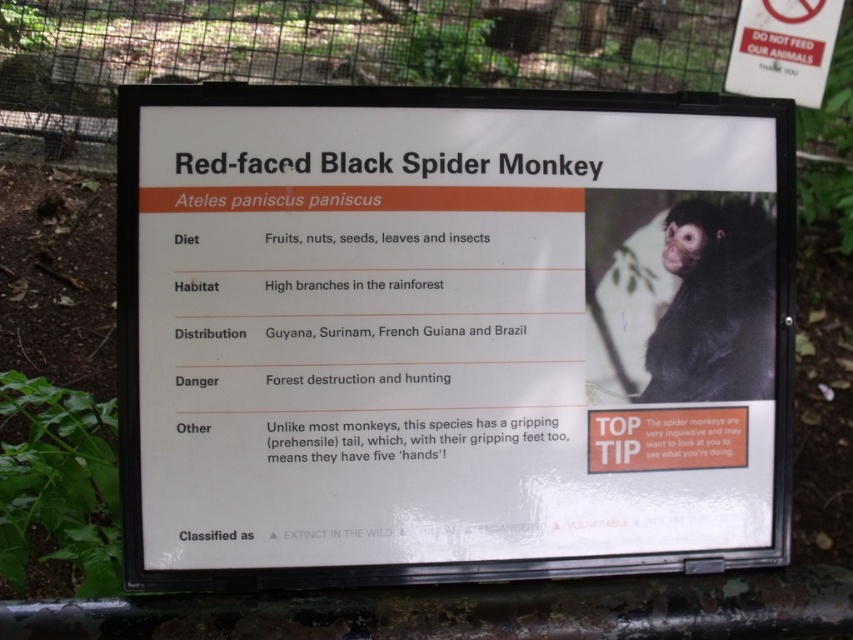
Question: Which point is closer to the camera?

Choices:
 (A) (567, 144)
 (B) (662, 328)

Answer: (A)

Question: Is white plastic sign at center thinner than black furry monkey at upper right?

Choices:
 (A) no
 (B) yes

Answer: (A)

Question: Is white plastic sign at center smaller than black furry monkey at upper right?

Choices:
 (A) yes
 (B) no

Answer: (B)

Question: Considering the relative positions of white plastic sign at center and black furry monkey at upper right in the image provided, where is white plastic sign at center located with respect to black furry monkey at upper right?

Choices:
 (A) right
 (B) left

Answer: (B)